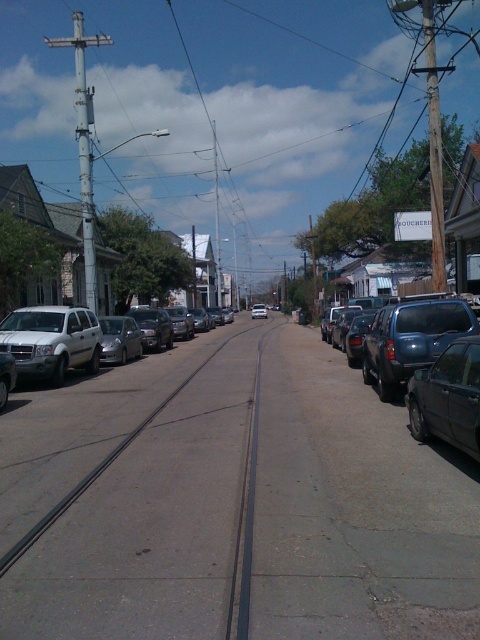
Question: Is silver metallic suv at left thinner than silver metallic sedan at center?

Choices:
 (A) yes
 (B) no

Answer: (A)

Question: Which point appears closest to the camera in this image?

Choices:
 (A) (458, 381)
 (B) (435, 308)
 (C) (48, 321)
 (D) (163, 369)

Answer: (A)

Question: Which of these objects is positioned closest to the metallic blue sedan at right?

Choices:
 (A) shiny black sedan at right
 (B) silver metallic suv at left
 (C) silver metallic sedan at center

Answer: (A)

Question: Considering the real-world distances, which object is closest to the silver metallic suv at left?

Choices:
 (A) shiny black sedan at right
 (B) metallic blue sedan at right
 (C) gray concrete pavement at center
 (D) silver metallic sedan at center

Answer: (C)

Question: Does metallic blue sedan at right appear under shiny black sedan at right?

Choices:
 (A) yes
 (B) no

Answer: (A)

Question: Does gray concrete pavement at center have a smaller size compared to shiny black sedan at right?

Choices:
 (A) no
 (B) yes

Answer: (A)